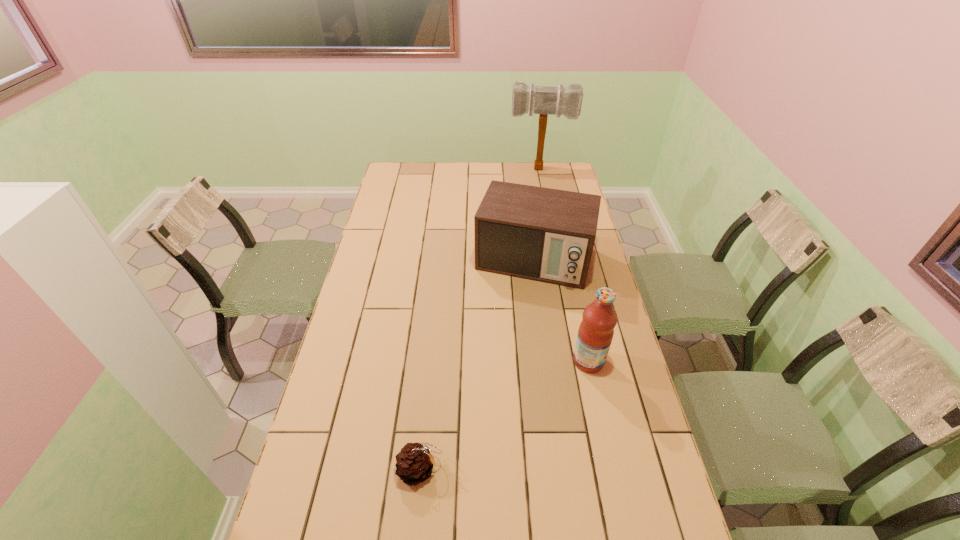
Image resolution: width=960 pixels, height=540 pixels. I want to click on object at the far right corner, so click(542, 100).

What are the coordinates of `vacant region at the far edge` in the screenshot? It's located at (453, 174).

Identify the location of free space at the left edge of the desktop. (395, 191).

This screenshot has height=540, width=960. What are the coordinates of `vacant space at the right edge` in the screenshot? It's located at (621, 405).

Find the location of a particular element. This screenshot has width=960, height=540. blank region between the second farthest object and the third shortest object is located at coordinates (562, 310).

Where is `free spot between the third tallest object and the shortest object`? free spot between the third tallest object and the shortest object is located at coordinates (477, 364).

The height and width of the screenshot is (540, 960). In order to click on free spot between the shortest object and the second farthest object in this screenshot , I will do `click(477, 364)`.

This screenshot has height=540, width=960. In order to click on empty space that is in between the fruit juice and the leftmost object in this screenshot , I will do `click(504, 415)`.

This screenshot has width=960, height=540. I want to click on vacant space that is in between the third tallest object and the nearest object, so click(477, 364).

You are a GUI agent. You are given a task and a screenshot of the screen. Output one action in this format:
    pyautogui.click(x=<x>, y=<y>)
    Task: Click on the unoccupied area between the leftmost object and the third tallest object
    
    Given the screenshot: What is the action you would take?
    pyautogui.click(x=477, y=364)